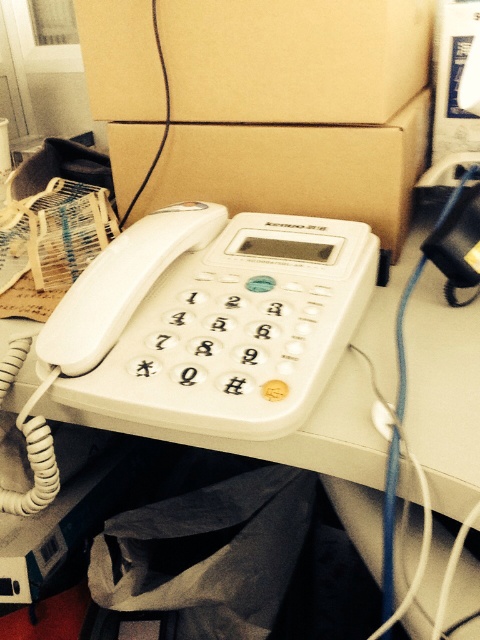
Between point (180, 422) and point (135, 148), which one is positioned in front?

Point (180, 422)

Between white plastic phone at upper center and brown cardboard box at center, which one is positioned higher?

brown cardboard box at center is higher up.

Who is more distant from viewer, (189, 394) or (165, 152)?

Positioned behind is point (165, 152).

In order to click on white plastic phone at upper center in this screenshot , I will do `click(229, 342)`.